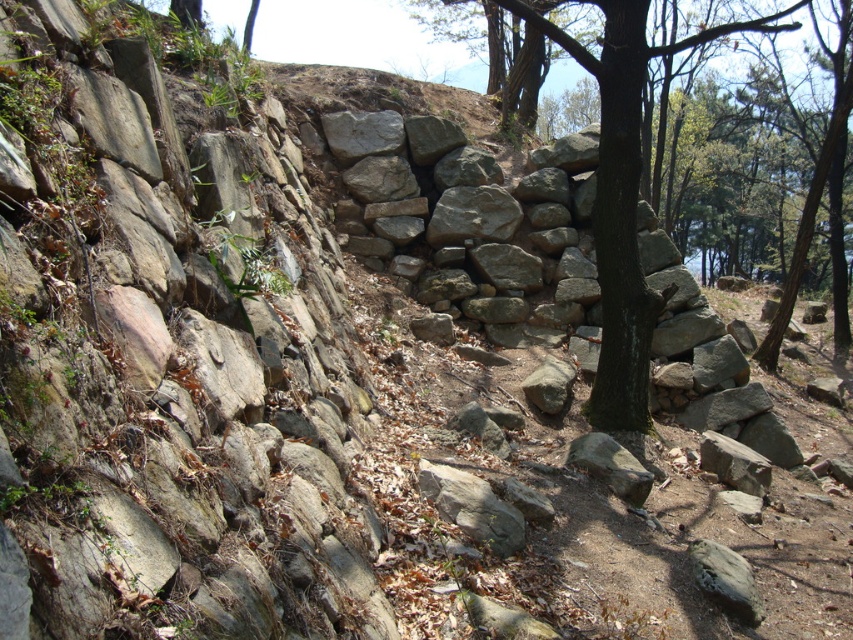
Does natural stone wall at left appear on the left side of green rough bark tree at center?

Correct, you'll find natural stone wall at left to the left of green rough bark tree at center.

Is point (351, 506) closer to camera compared to point (605, 314)?

Yes, it is in front of point (605, 314).

Which is in front, point (96, 440) or point (578, 3)?

Point (96, 440) is in front.

Locate an element on the screen. This screenshot has width=853, height=640. natural stone wall at left is located at coordinates (167, 360).